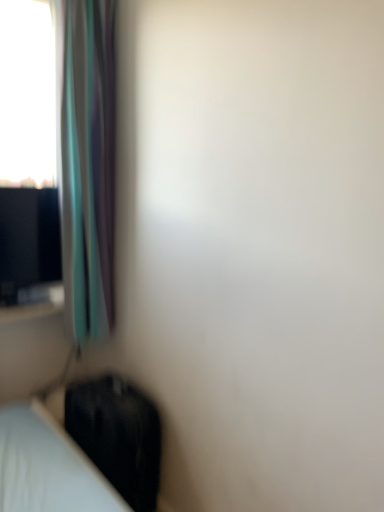
Question: From the image's perspective, is translucent fabric curtain at left positioned above or below black fabric luggage at lower left?

Choices:
 (A) below
 (B) above

Answer: (B)

Question: Considering the positions of point (72, 239) and point (114, 381), is point (72, 239) closer or farther from the camera than point (114, 381)?

Choices:
 (A) closer
 (B) farther

Answer: (B)

Question: Based on their sizes in the image, would you say translucent fabric curtain at left is bigger or smaller than black fabric luggage at lower left?

Choices:
 (A) big
 (B) small

Answer: (A)

Question: Do you think black fabric luggage at lower left is within translucent fabric curtain at left, or outside of it?

Choices:
 (A) outside
 (B) inside

Answer: (A)

Question: Is point (102, 423) positioned closer to the camera than point (84, 68)?

Choices:
 (A) closer
 (B) farther

Answer: (A)

Question: Is black fabric luggage at lower left in front of or behind translucent fabric curtain at left in the image?

Choices:
 (A) front
 (B) behind

Answer: (B)

Question: Looking at their shapes, would you say black fabric luggage at lower left is wider or thinner than translucent fabric curtain at left?

Choices:
 (A) wide
 (B) thin

Answer: (A)